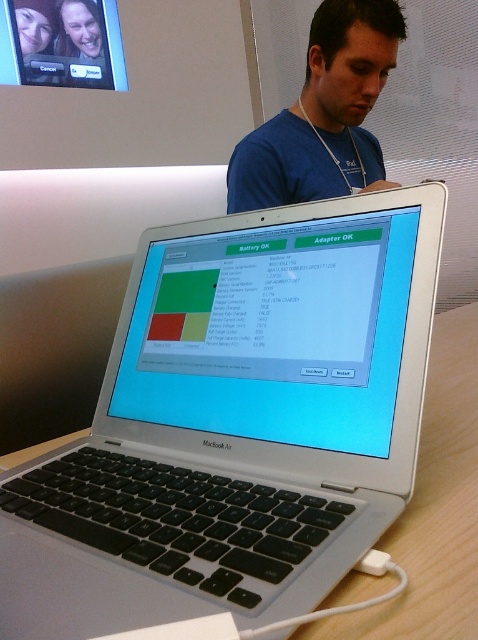
Can you confirm if silver metallic laptop at center is positioned below blue fabric shirt at center?

Correct, silver metallic laptop at center is located below blue fabric shirt at center.

In the scene shown: Between silver metallic laptop at center and blue fabric shirt at center, which one appears on the right side from the viewer's perspective?

Positioned to the right is blue fabric shirt at center.

The width and height of the screenshot is (478, 640). What do you see at coordinates (271, 328) in the screenshot? I see `silver metallic laptop at center` at bounding box center [271, 328].

Find the location of a particular element. The height and width of the screenshot is (640, 478). silver metallic laptop at center is located at coordinates click(271, 328).

Find the location of a particular element. This screenshot has width=478, height=640. silver/black keyboard at center is located at coordinates (235, 426).

Who is higher up, silver/black keyboard at center or blue fabric shirt at center?

blue fabric shirt at center is higher up.

The image size is (478, 640). Find the location of `silver/black keyboard at center`. silver/black keyboard at center is located at coordinates (235, 426).

Which is behind, point (256, 428) or point (330, 332)?

Positioned behind is point (256, 428).

Is point (313, 577) farther from viewer compared to point (388, 326)?

No.

You are a GUI agent. You are given a task and a screenshot of the screen. Output one action in this format:
    pyautogui.click(x=<x>, y=<y>)
    Task: Click on the silver/black keyboard at center
    
    Given the screenshot: What is the action you would take?
    pyautogui.click(x=235, y=426)